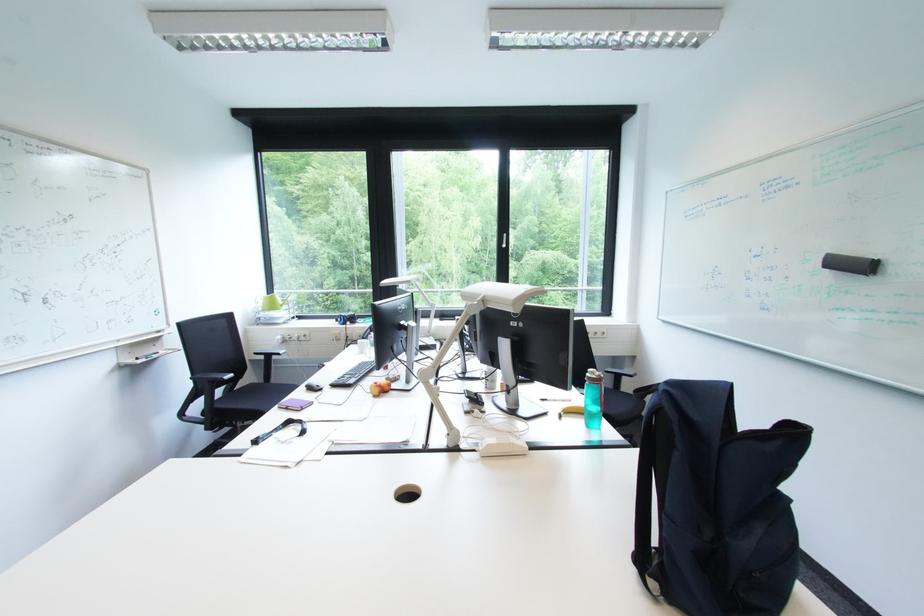
The image size is (924, 616). Describe the element at coordinates (257, 395) in the screenshot. I see `the black chair sitting surface` at that location.